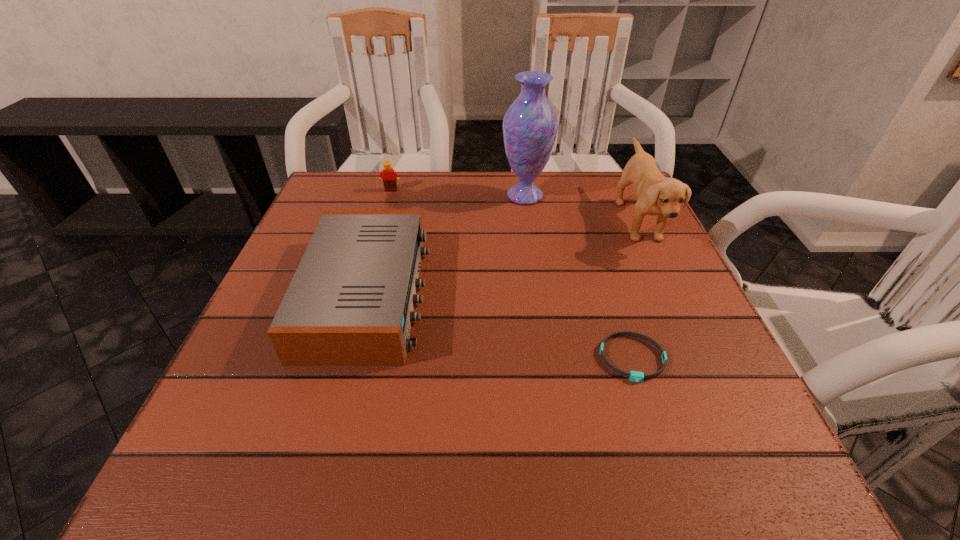
The width and height of the screenshot is (960, 540). I want to click on vacant space located 0.050m on the left side of the rightmost object, so pos(598,221).

Identify the location of vacant point located on the left side of the rightmost object. (454, 221).

Locate an element on the screen. The image size is (960, 540). free space located on the face of the Lego is located at coordinates (384, 214).

I want to click on free spot located 0.050m on the front panel of the radio receiver, so click(450, 295).

Where is `vacant area situated 0.110m on the buckle of the wristband`? vacant area situated 0.110m on the buckle of the wristband is located at coordinates (661, 450).

Where is `vase located at the far edge`? This screenshot has width=960, height=540. vase located at the far edge is located at coordinates (530, 125).

Locate an element on the screen. The width and height of the screenshot is (960, 540). puppy located in the far edge section of the desktop is located at coordinates (656, 194).

Where is `Lego present at the far edge`? The width and height of the screenshot is (960, 540). Lego present at the far edge is located at coordinates coord(390,176).

The height and width of the screenshot is (540, 960). What are the coordinates of `Lego at the left edge` in the screenshot? It's located at (390, 176).

The image size is (960, 540). Identify the location of radio receiver that is at the left edge. (350, 302).